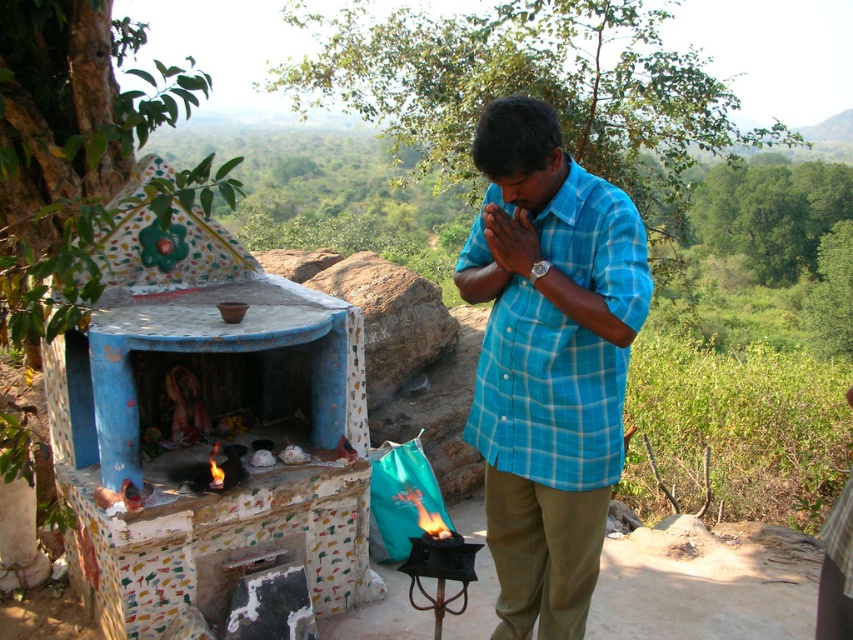
You are a photographer trying to capture the shrine and the man in a single shot. You notice two points marked on your viewfinder at coordinates point (x=492, y=291) and point (x=523, y=266). Which point is closer to the camera?

Point (x=492, y=291) is further to the viewer than point (x=523, y=266). Therefore, point (x=523, y=266) is closer to the camera.

Where is the blue plaid shirt at center located in the image?

The blue plaid shirt at center is located at point (550,365) in the image.

You are a photographer standing at a distance of 7 feet from the blue plaid shirt at center. You want to take a closeup shot of the shrine. Is your current distance sufficient to capture the shrine clearly without moving closer?

The blue plaid shirt at center and viewer are 7.35 feet apart. Since you are already at 7 feet away, you are close enough to capture the shrine clearly without needing to move closer.